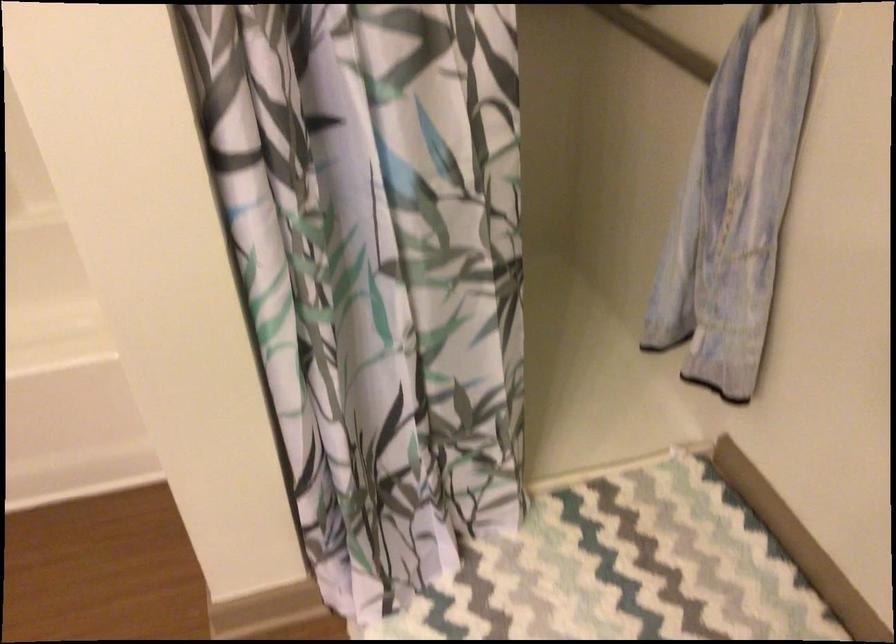
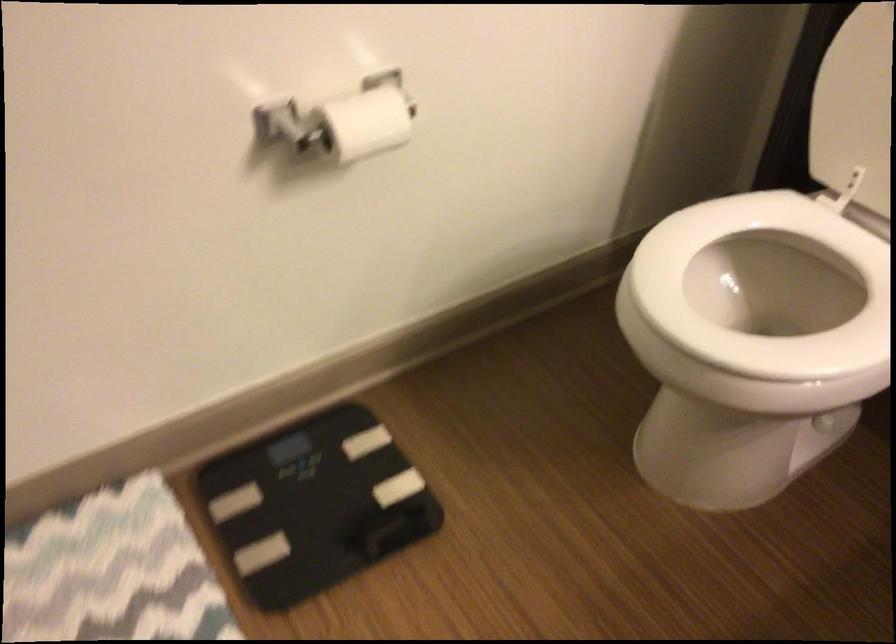
Based on the photo, how did the camera likely rotate?

The rotation direction of the camera is right-down.